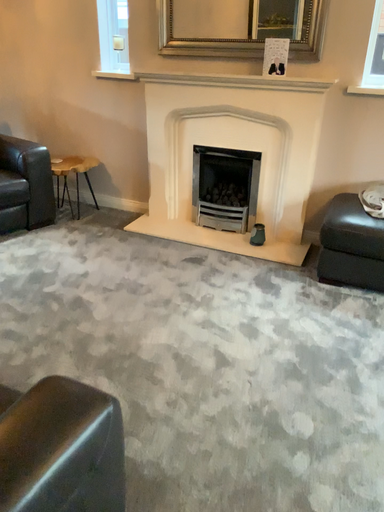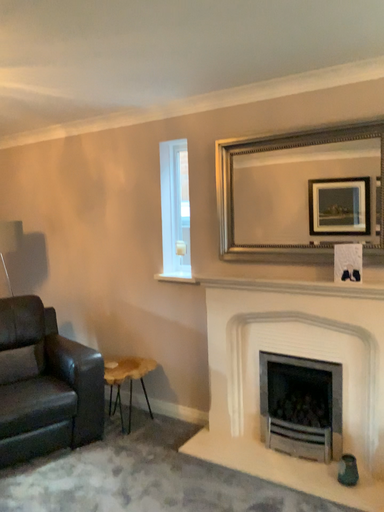
Question: How did the camera likely rotate when shooting the video?

Choices:
 (A) rotated left
 (B) rotated right

Answer: (A)